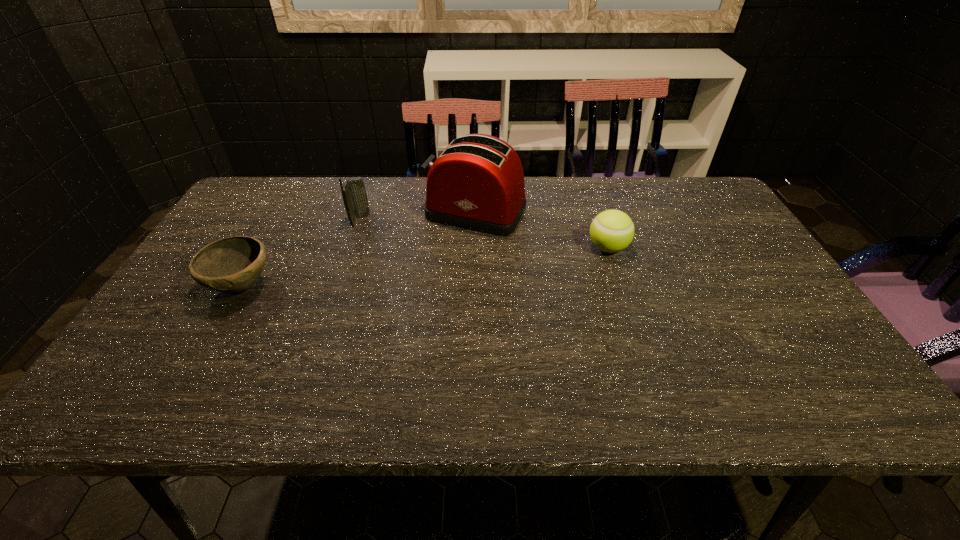
Point out which object is positioned as the second nearest to the rightmost object. Please provide its 2D coordinates. Your answer should be formatted as a tuple, i.e. [(x, y)], where the tuple contains the x and y coordinates of a point satisfying the conditions above.

[(354, 195)]

Select which object appears as the third closest to the tallest object. Please provide its 2D coordinates. Your answer should be formatted as a tuple, i.e. [(x, y)], where the tuple contains the x and y coordinates of a point satisfying the conditions above.

[(233, 264)]

You are a GUI agent. You are given a task and a screenshot of the screen. Output one action in this format:
    pyautogui.click(x=<x>, y=<y>)
    Task: Click on the blank area in the image that satisfies the following two spatial constraints: 1. on the keyboard of the tennis ball; 2. on the left side of the third object from right to left
    This screenshot has width=960, height=540.
    Given the screenshot: What is the action you would take?
    pyautogui.click(x=351, y=248)

Identify the location of free space in the image that satisfies the following two spatial constraints: 1. on the keyboard of the rightmost object; 2. on the left side of the cellular telephone. (351, 248).

This screenshot has width=960, height=540. What are the coordinates of `vacant region that satisfies the following two spatial constraints: 1. on the front side of the tallest object; 2. on the keyboard of the second object from left to right` in the screenshot? It's located at (474, 220).

Where is `vacant area that satisfies the following two spatial constraints: 1. on the front side of the toaster; 2. on the right side of the rightmost object`? This screenshot has height=540, width=960. vacant area that satisfies the following two spatial constraints: 1. on the front side of the toaster; 2. on the right side of the rightmost object is located at coordinates (474, 248).

The image size is (960, 540). What are the coordinates of `free space that satisfies the following two spatial constraints: 1. on the keyboard of the third object from right to left; 2. on the back side of the tennis ball` in the screenshot? It's located at (351, 248).